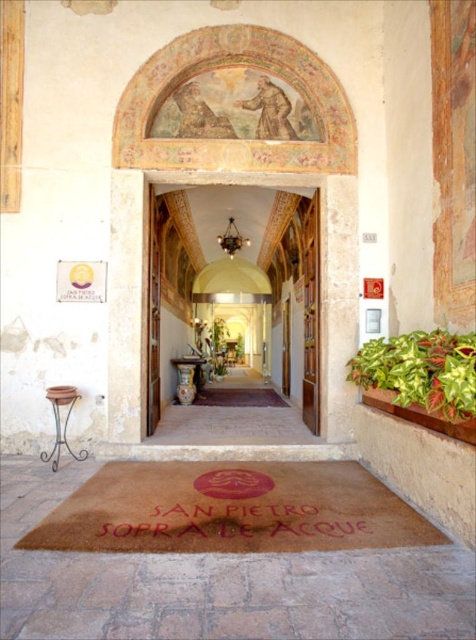
Between brown coir mat at center and green variegated leaf at right, which one is positioned lower?

brown coir mat at center

Does brown coir mat at center have a greater height compared to green variegated leaf at right?

No, brown coir mat at center is not taller than green variegated leaf at right.

Locate an element on the screen. This screenshot has height=640, width=476. brown coir mat at center is located at coordinates coord(230,509).

This screenshot has width=476, height=640. Identify the location of brown coir mat at center. click(230, 509).

Does matte gold door at center appear on the right side of brown matte doormat at center?

No, matte gold door at center is not to the right of brown matte doormat at center.

What do you see at coordinates (243, 284) in the screenshot? I see `matte gold door at center` at bounding box center [243, 284].

The width and height of the screenshot is (476, 640). Identify the location of matte gold door at center. (243, 284).

Between green variegated leaf at right and brown matte doormat at center, which one appears on the left side from the viewer's perspective?

brown matte doormat at center

Can you confirm if green variegated leaf at right is positioned below brown matte doormat at center?

No, green variegated leaf at right is not below brown matte doormat at center.

Is point (447, 413) less distant than point (266, 406)?

Yes, point (447, 413) is in front of point (266, 406).

The height and width of the screenshot is (640, 476). I want to click on green variegated leaf at right, so click(420, 371).